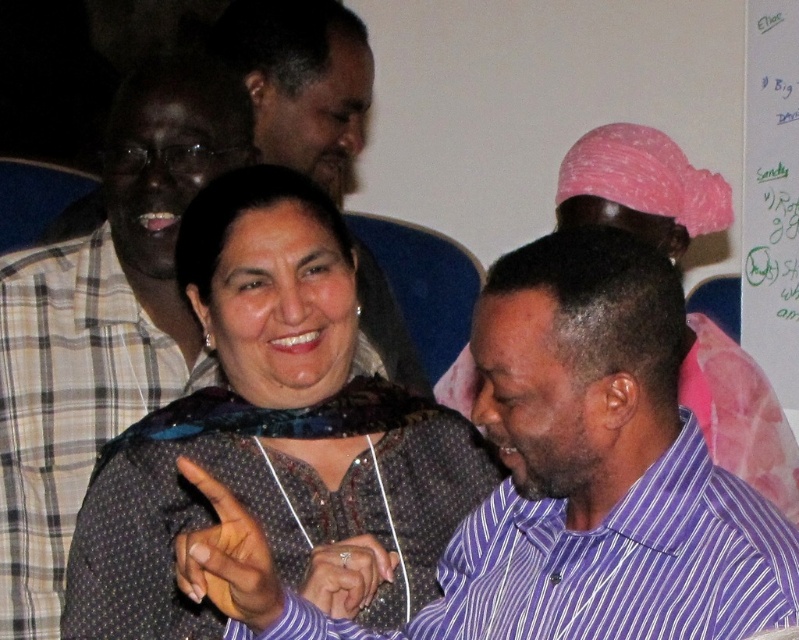
Question: Which point appears closest to the camera in this image?

Choices:
 (A) (237, 332)
 (B) (696, 432)
 (C) (782, 17)

Answer: (B)

Question: Is purple striped shirt at lower right thinner than white paper at upper right?

Choices:
 (A) yes
 (B) no

Answer: (B)

Question: Can you confirm if dark blue printed dress at center is positioned above white paper at upper right?

Choices:
 (A) yes
 (B) no

Answer: (B)

Question: Is dark blue printed dress at center closer to camera compared to purple striped shirt at lower right?

Choices:
 (A) no
 (B) yes

Answer: (A)

Question: Estimate the real-world distances between objects in this image. Which object is closer to the dark blue printed dress at center?

Choices:
 (A) purple striped shirt at lower right
 (B) white paper at upper right

Answer: (A)

Question: Estimate the real-world distances between objects in this image. Which object is farther from the dark blue printed dress at center?

Choices:
 (A) purple striped shirt at lower right
 (B) white paper at upper right

Answer: (B)